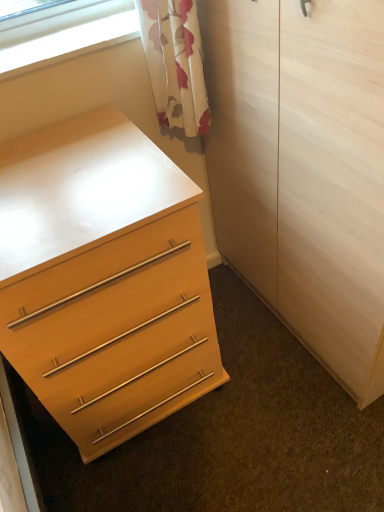
What are the coordinates of `vacant area on top of clear glass window at upper left (from a real-world perspective)` in the screenshot? It's located at (61, 37).